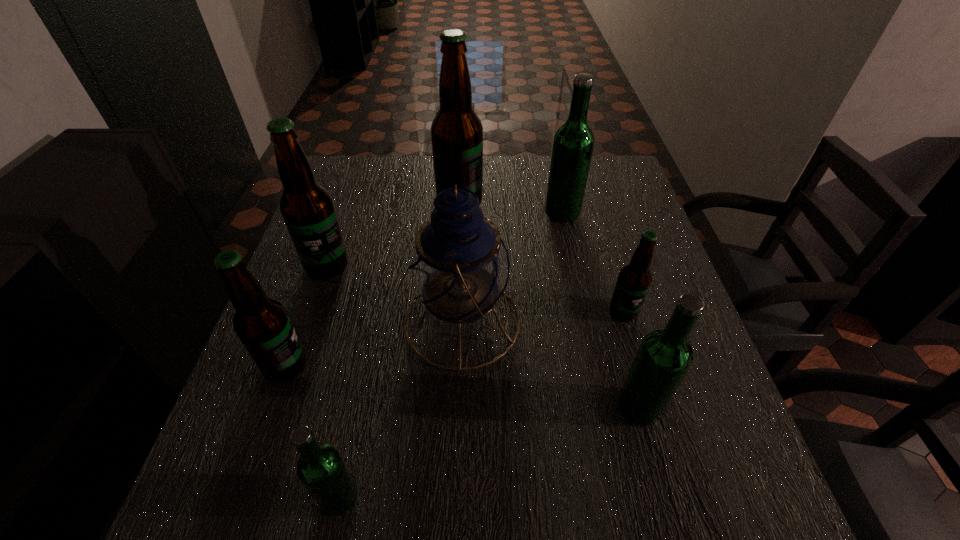
The height and width of the screenshot is (540, 960). Find the location of `the tallest beer bottle`. the tallest beer bottle is located at coordinates (456, 132).

Identify the location of the tallest object. The image size is (960, 540). (456, 132).

I want to click on the biggest green beer bottle, so click(573, 143).

Where is `the third smallest brown beer bottle`? the third smallest brown beer bottle is located at coordinates (307, 208).

Identify the location of the third farthest beer bottle. (307, 208).

Locate an element on the screen. Image resolution: width=960 pixels, height=540 pixels. blue lantern is located at coordinates (459, 267).

The height and width of the screenshot is (540, 960). Find the location of `the third nearest beer bottle`. the third nearest beer bottle is located at coordinates (262, 324).

You are a GUI agent. You are given a task and a screenshot of the screen. Output one action in this format:
    pyautogui.click(x=<x>, y=<y>)
    Task: Click on the second smallest brown beer bottle
    Image resolution: width=960 pixels, height=540 pixels.
    Given the screenshot: What is the action you would take?
    pyautogui.click(x=262, y=324)

Find the location of a particular element. the second smallest green beer bottle is located at coordinates (664, 357).

At what (x,y) coordinates should I click in order to perform the action: click on the sixth farthest beer bottle. Please return your answer as a coordinate pair (x, y). This screenshot has width=960, height=540. Looking at the image, I should click on (664, 357).